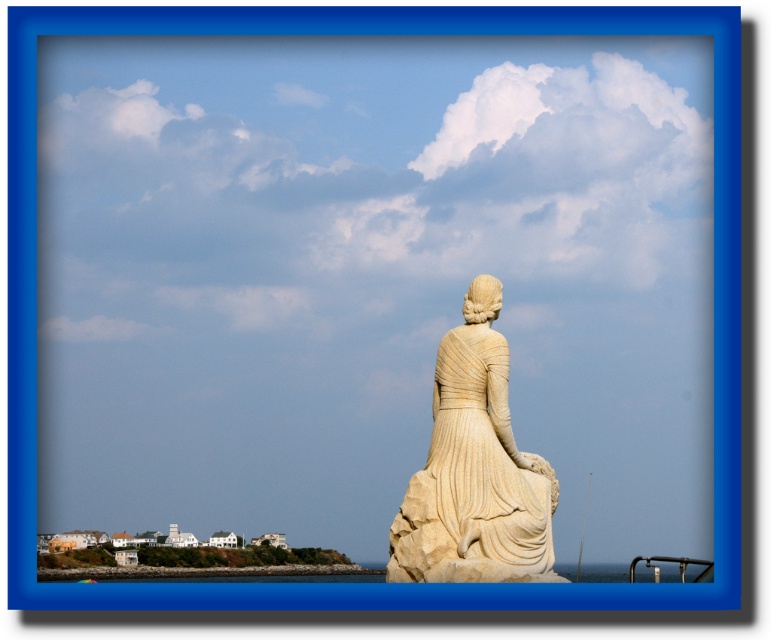
Who is shorter, white marble statue at center or clear blue water at lower center?

With less height is white marble statue at center.

Between point (463, 484) and point (214, 568), which one is positioned behind?

Positioned behind is point (214, 568).

Image resolution: width=771 pixels, height=640 pixels. Identify the location of white marble statue at center. (473, 468).

The width and height of the screenshot is (771, 640). I want to click on white marble statue at center, so click(473, 468).